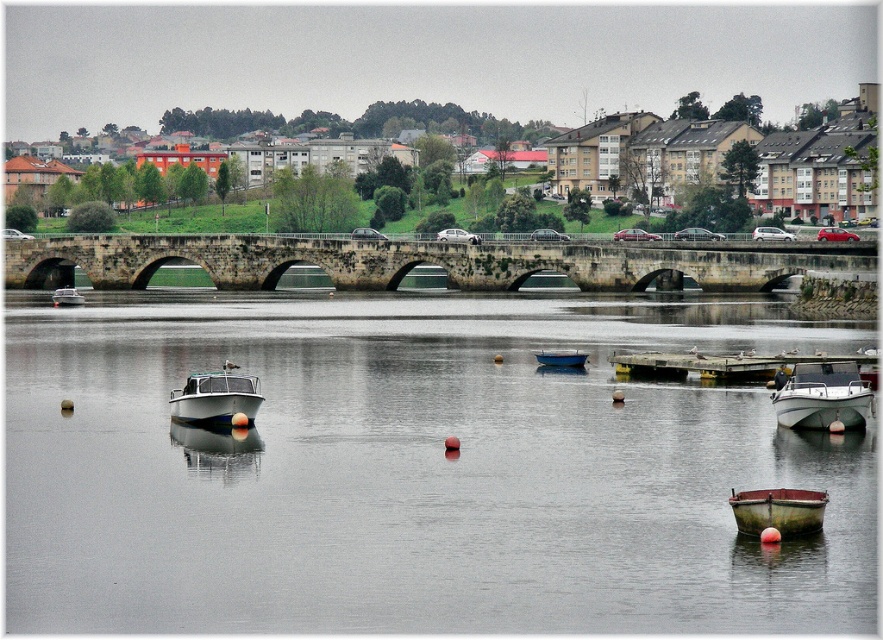
You are standing at the riverside and want to reach a specific point marked at coordinates point (843, 632). If your walking speed is 1.5 meters per second, how long will it take you to reach that point?

The distance between you and point (843, 632) is 27.88 meters. At a walking speed of 1.5 meters per second, it will take approximately 18.59 seconds to reach the point.

You are a delivery person needing to cross the stone bridge with a package. The white glossy boat at center and the rusty wooden boat at lower right are in your path. Can you safely navigate around them without hitting either boat?

The white glossy boat at center and the rusty wooden boat at lower right are 17.26 meters apart. Since the distance between them is sufficient for safe passage, you can navigate around them without any issues.